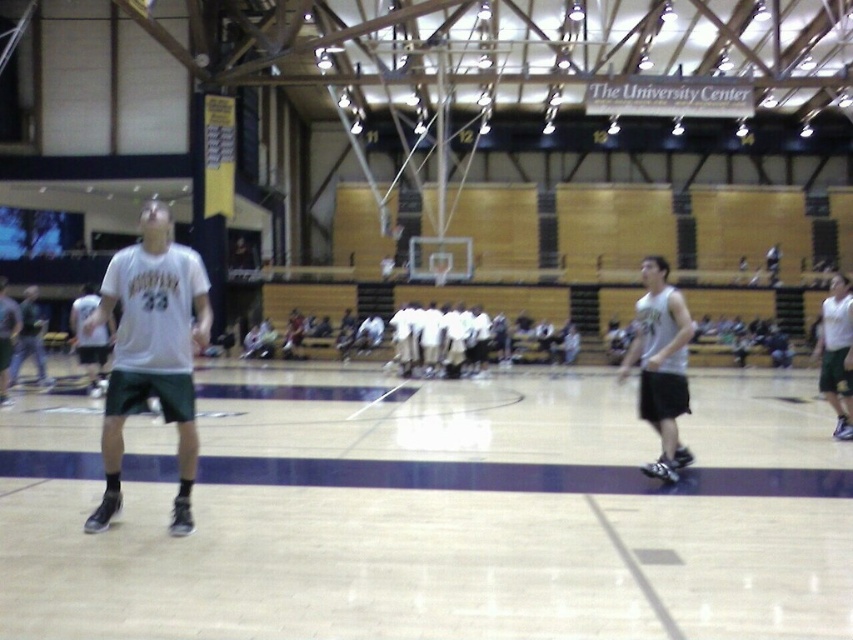
Can you confirm if wooden floor at center is smaller than white jersey at left?

Yes.

Between wooden floor at center and white jersey at left, which one is positioned lower?

wooden floor at center is lower down.

Is point (740, 401) positioned before point (16, 376)?

No, it is behind (16, 376).

The width and height of the screenshot is (853, 640). Identify the location of wooden floor at center. (437, 515).

Does white jersey at center appear over white jersey at left?

Incorrect, white jersey at center is not positioned above white jersey at left.

Is white jersey at center thinner than white jersey at left?

Yes, white jersey at center is thinner than white jersey at left.

The image size is (853, 640). What do you see at coordinates (660, 364) in the screenshot? I see `white jersey at center` at bounding box center [660, 364].

Identify the location of white jersey at center. Image resolution: width=853 pixels, height=640 pixels. (660, 364).

Between point (718, 611) and point (657, 337), which one is positioned in front?

Point (718, 611) is more forward.

What do you see at coordinates (437, 515) in the screenshot? I see `wooden floor at center` at bounding box center [437, 515].

The width and height of the screenshot is (853, 640). I want to click on wooden floor at center, so click(x=437, y=515).